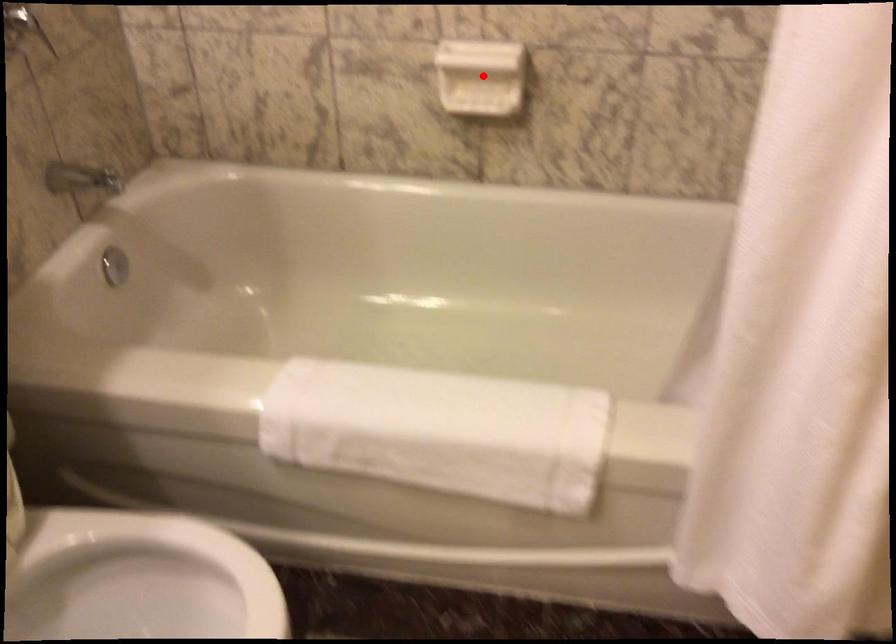
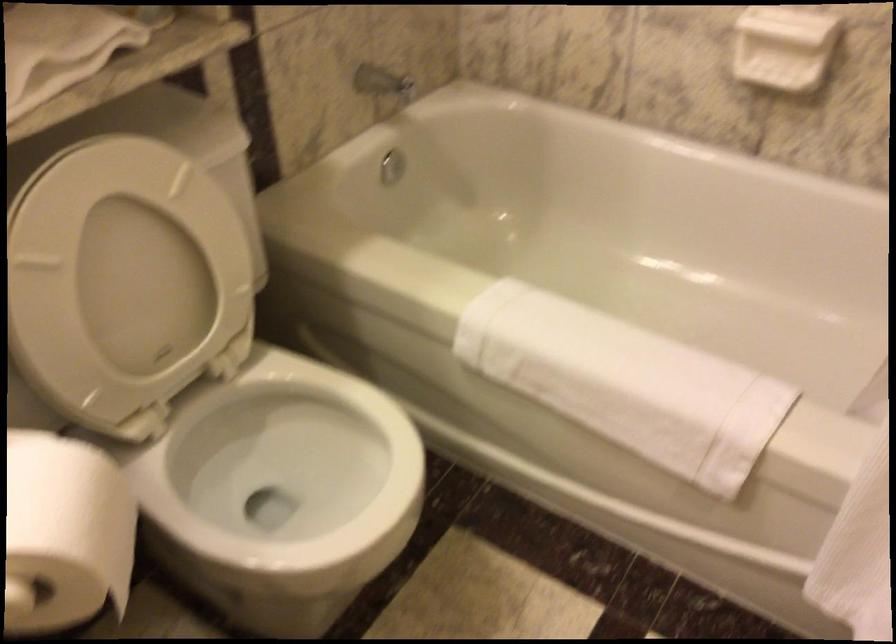
In the second image, find the point that corresponds to the highlighted location in the first image.

(782, 46)